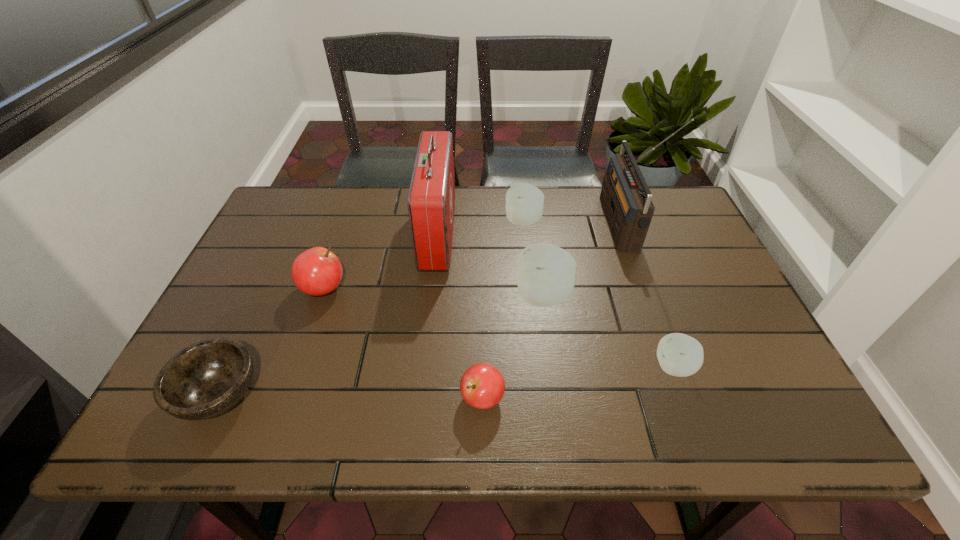
I want to click on object that is at the near left corner, so click(x=206, y=379).

Image resolution: width=960 pixels, height=540 pixels. Find the location of `free space at the far edge of the desktop`. free space at the far edge of the desktop is located at coordinates (562, 208).

Where is `free space at the near edge`? Image resolution: width=960 pixels, height=540 pixels. free space at the near edge is located at coordinates (388, 402).

In the image, there is a desktop. Find the location of `vacant space at the right edge`. vacant space at the right edge is located at coordinates (700, 241).

Where is `free location at the far left corner`? The height and width of the screenshot is (540, 960). free location at the far left corner is located at coordinates (308, 187).

You are a GUI agent. You are given a task and a screenshot of the screen. Output one action in this format:
    pyautogui.click(x=<x>, y=<y>)
    Task: Click on the vacant space at the far right corner
    The height and width of the screenshot is (540, 960).
    Given the screenshot: What is the action you would take?
    pyautogui.click(x=671, y=220)

The image size is (960, 540). Find the location of `vacant space in between the tallest object and the seventh shortest object`. vacant space in between the tallest object and the seventh shortest object is located at coordinates (529, 230).

The image size is (960, 540). What are the coordinates of `vacant area that lies between the brown bowl and the farthest white apple` in the screenshot? It's located at (372, 308).

Where is `vacant area between the brown bowl and the second apple from left to right`? The height and width of the screenshot is (540, 960). vacant area between the brown bowl and the second apple from left to right is located at coordinates (351, 396).

At what (x,y) coordinates should I click in order to perform the action: click on blank region between the second apple from left to right and the nearest white apple. Please return your answer as a coordinate pair (x, y). The image size is (960, 540). Looking at the image, I should click on (578, 383).